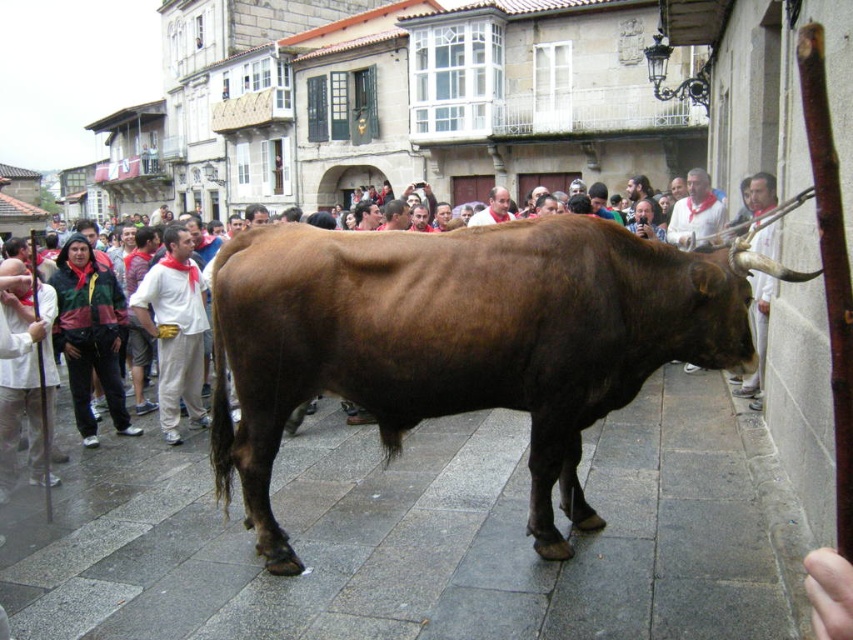
From the picture: Is gray stone pavement at center to the left of brown glossy cow at center from the viewer's perspective?

Yes, gray stone pavement at center is to the left of brown glossy cow at center.

Can you confirm if gray stone pavement at center is wider than brown glossy cow at center?

Indeed, gray stone pavement at center has a greater width compared to brown glossy cow at center.

Is point (335, 538) less distant than point (556, 452)?

No, (335, 538) is further to viewer.

Where is `gray stone pavement at center`? The height and width of the screenshot is (640, 853). gray stone pavement at center is located at coordinates (424, 536).